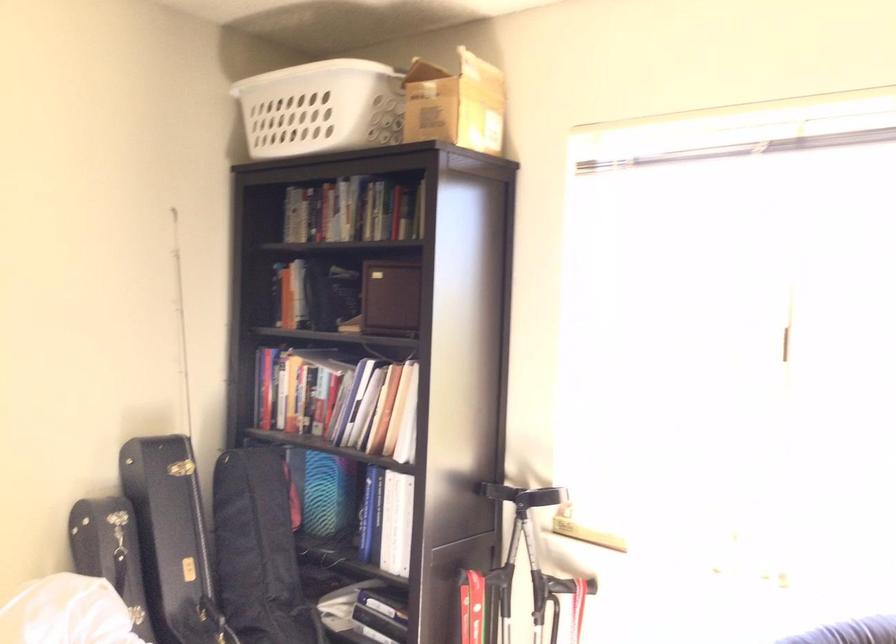
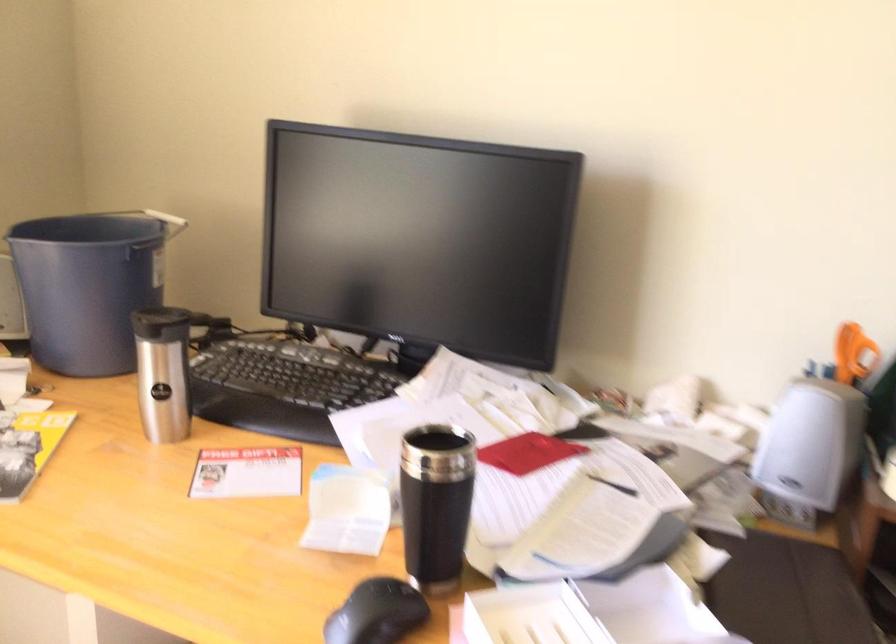
How did the camera likely rotate?

The rotation direction of the camera is right-down.